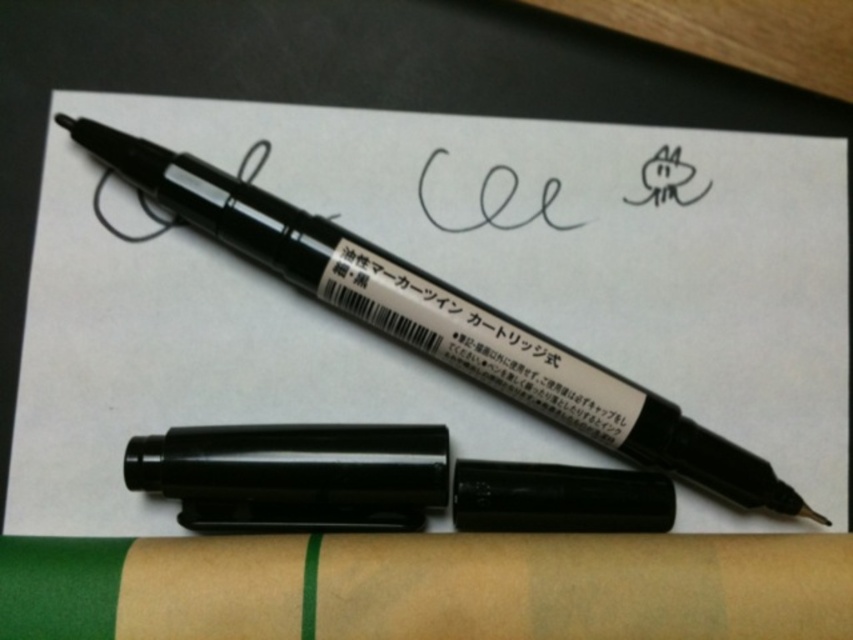
You are organizing stationery on a desk and see the matte black pen at center and the black matte pen at center. Which one is positioned more to the right?

The matte black pen at center is positioned more to the right than the black matte pen at center.

You have two pens in front of you on the paper. The matte black pen at center and the black matte marker at center. Which one is wider?

The matte black pen at center is wider than the black matte marker at center.

Please provide the exact coordinates of the matte black pen at center in the image. The coordinate system has the origin at the bottom left corner of the image, with x increasing to the right and y increasing upwards. The coordinates are normalized between 0 and 1.

The exact coordinates of the matte black pen at center are at point 0.503 in the x direction and 0.518 in the y direction.